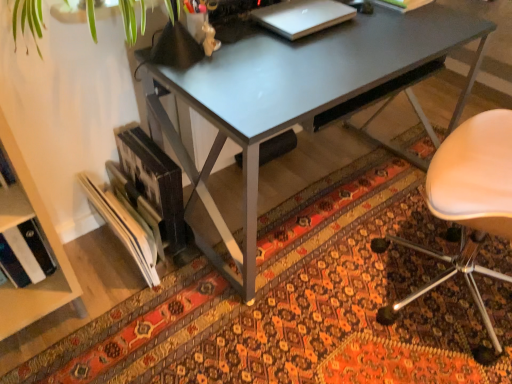
Locate an element on the screen. The image size is (512, 384). free space in front of sleek silver laptop at upper center is located at coordinates (311, 54).